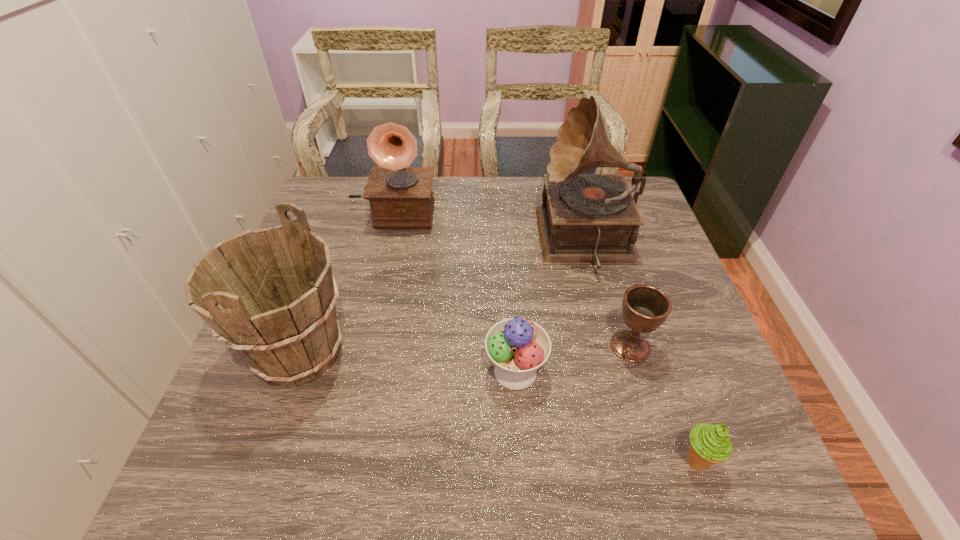
At what (x,y) coordinates should I click in order to perform the action: click on the tallest object. Please return your answer as a coordinate pair (x, y). The height and width of the screenshot is (540, 960). Looking at the image, I should click on (585, 219).

Locate an element on the screen. The height and width of the screenshot is (540, 960). the right record player is located at coordinates (585, 219).

The image size is (960, 540). I want to click on the shorter record player, so click(400, 196).

Where is `bucket`? Image resolution: width=960 pixels, height=540 pixels. bucket is located at coordinates (270, 294).

Locate an element on the screen. Image resolution: width=960 pixels, height=540 pixels. the farther icecream is located at coordinates (518, 347).

You are a GUI agent. You are given a task and a screenshot of the screen. Output one action in this format:
    pyautogui.click(x=<x>, y=<y>)
    Task: Click on the fourth object from right to left
    
    Given the screenshot: What is the action you would take?
    pyautogui.click(x=518, y=347)

This screenshot has width=960, height=540. In order to click on chalice in this screenshot , I will do `click(644, 307)`.

The height and width of the screenshot is (540, 960). I want to click on the nearest object, so click(710, 444).

This screenshot has width=960, height=540. Find the location of `the nearer icecream`. the nearer icecream is located at coordinates (710, 444).

I want to click on vacant space located from the horn of the tallest object, so click(508, 241).